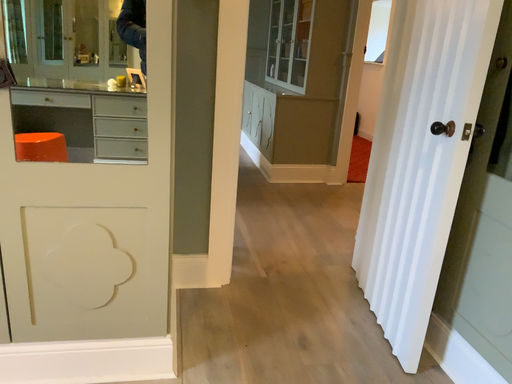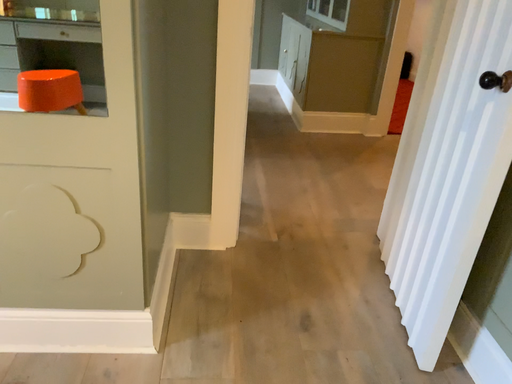
Question: How did the camera likely rotate when shooting the video?

Choices:
 (A) rotated right
 (B) rotated left

Answer: (B)